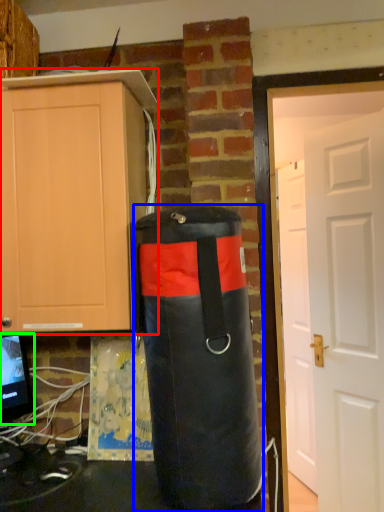
Question: Considering the real-world distances, which object is farthest from cabinetry (highlighted by a red box)? punching bag (highlighted by a blue box) or computer monitor (highlighted by a green box)?

Choices:
 (A) punching bag
 (B) computer monitor

Answer: (B)